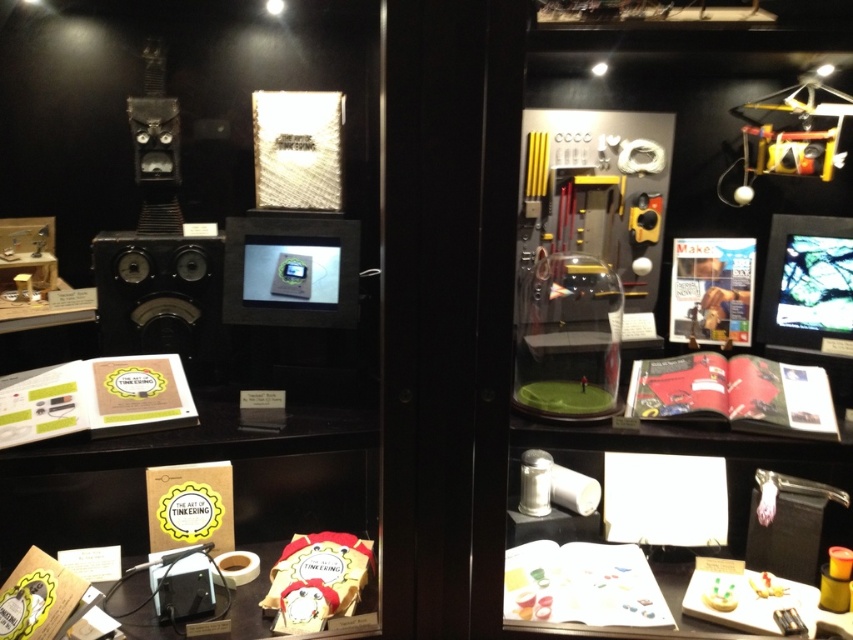
You are a museum visitor trying to take a photo of the clear glass dome at center and the matte black speaker at left. Since you want both objects to be fully visible in the frame, which object should you focus on to ensure the taller one is captured properly?

The clear glass dome at center is much taller than the matte black speaker at left, so you should focus on the clear glass dome at center to ensure its full height is captured in the photo.

In the scene shown: You are a visitor looking at the display case. You notice the matte black speaker at left and the metallic yellow helicopter at upper right. Which object is positioned higher in the display case?

The metallic yellow helicopter at upper right is positioned higher than the matte black speaker at left.

You are a museum visitor observing the display case. You notice the clear glass dome at center and the metallic yellow helicopter at upper right. Which object is taller?

The clear glass dome at center is taller than the metallic yellow helicopter at upper right.